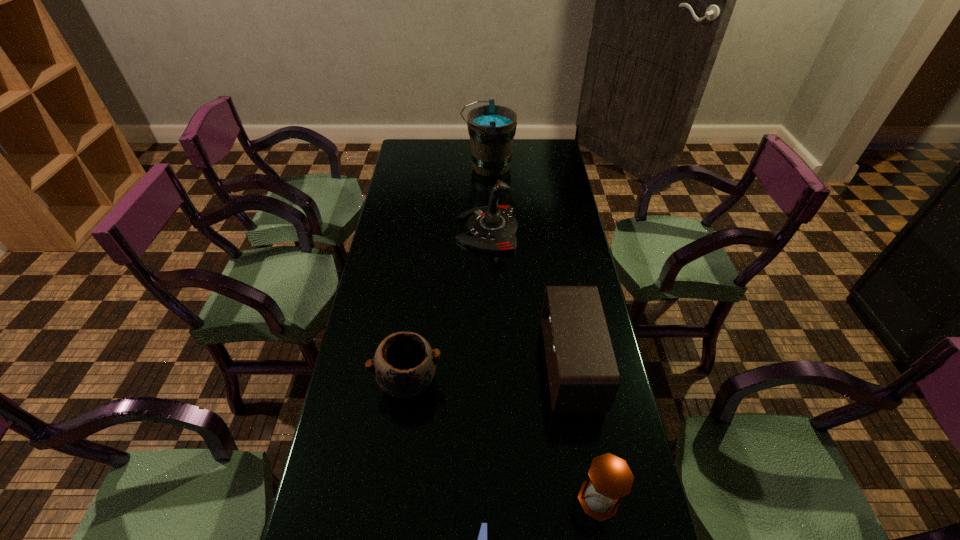
Find the location of a particular element. The height and width of the screenshot is (540, 960). vacant space located on the handle side of the second farthest object is located at coordinates (438, 230).

Identify the location of free spot located 0.180m on the handle side of the second farthest object. This screenshot has width=960, height=540. (409, 230).

Locate an element on the screen. Image resolution: width=960 pixels, height=540 pixels. free space located on the handle side of the second farthest object is located at coordinates (388, 230).

Where is `vacant position located on the front-facing side of the radio receiver`? This screenshot has height=540, width=960. vacant position located on the front-facing side of the radio receiver is located at coordinates (442, 365).

Locate an element on the screen. The height and width of the screenshot is (540, 960). free spot located 0.290m on the front-facing side of the radio receiver is located at coordinates (444, 365).

The width and height of the screenshot is (960, 540). I want to click on free space located 0.080m on the front-facing side of the radio receiver, so click(x=518, y=365).

The width and height of the screenshot is (960, 540). What are the coordinates of `free space located 0.120m on the right of the pottery` in the screenshot? It's located at (486, 381).

Find the location of a particular element. This screenshot has width=960, height=540. vacant space situated on the back of the hourglass is located at coordinates (580, 392).

This screenshot has height=540, width=960. Identify the location of object that is at the far edge. (491, 128).

Locate an element on the screen. Image resolution: width=960 pixels, height=540 pixels. object present at the left edge is located at coordinates (404, 364).